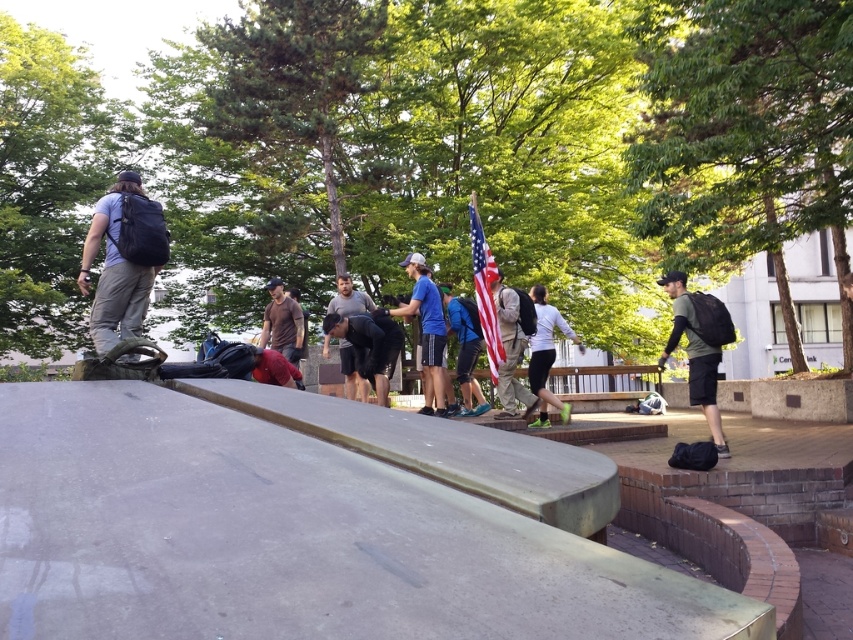
You are standing at the center of the paved area in the park scene. There is a curved concrete bench at the edge of the paved area and a group of people near the center. You notice a point marked at coordinates (694, 355). What object or person is located at this point?

The point at coordinates (694, 355) corresponds to the matte green tshirt at right.

You are a photographer setting up a tripod to capture the scene. You need to ensure that the matte black backpack at upper left and the white matte shirt at center are both in frame. Given that the camera has a fixed focal length, which object should you prioritize positioning closer to the center of the frame to ensure both are visible without zooming?

Since the matte black backpack at upper left is wider than the white matte shirt at center, you should prioritize positioning the matte black backpack at upper left closer to the center of the frame to ensure both objects are visible without zooming.